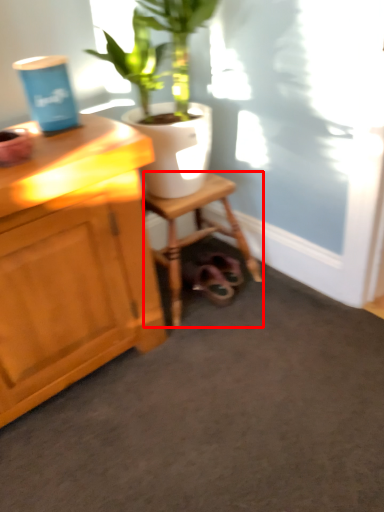
Question: From the image's perspective, what is the correct spatial positioning of stool (annotated by the red box) in reference to houseplant?

Choices:
 (A) above
 (B) below

Answer: (B)